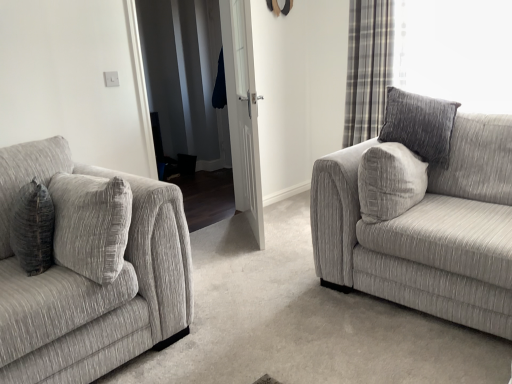
Question: From a real-world perspective, is textured gray couch at right, marked as the 2th studio couch in a left-to-right arrangement, below textured gray couch at left, acting as the 2th studio couch starting from the right?

Choices:
 (A) yes
 (B) no

Answer: (A)

Question: Is textured gray couch at right, which is counted as the first studio couch, starting from the right, at the right side of textured gray couch at left, acting as the 2th studio couch starting from the right?

Choices:
 (A) yes
 (B) no

Answer: (A)

Question: Does textured gray couch at right, marked as the 2th studio couch in a left-to-right arrangement, come behind textured gray couch at left, acting as the 2th studio couch starting from the right?

Choices:
 (A) yes
 (B) no

Answer: (A)

Question: Considering the relative positions of textured gray couch at right, which is counted as the first studio couch, starting from the right, and textured gray couch at left, acting as the 2th studio couch starting from the right, in the image provided, is textured gray couch at right, which is counted as the first studio couch, starting from the right, to the left of textured gray couch at left, acting as the 2th studio couch starting from the right, from the viewer's perspective?

Choices:
 (A) no
 (B) yes

Answer: (A)

Question: Does textured gray couch at right, which is counted as the first studio couch, starting from the right, have a lesser height compared to textured gray couch at left, which is counted as the first studio couch, starting from the left?

Choices:
 (A) no
 (B) yes

Answer: (B)

Question: From a real-world perspective, is textured gray couch at right, marked as the 2th studio couch in a left-to-right arrangement, positioned above or below white glossy door at center?

Choices:
 (A) below
 (B) above

Answer: (A)

Question: Relative to white glossy door at center, is textured gray couch at right, which is counted as the first studio couch, starting from the right, in front or behind?

Choices:
 (A) behind
 (B) front

Answer: (B)

Question: In terms of height, does textured gray couch at right, marked as the 2th studio couch in a left-to-right arrangement, look taller or shorter compared to white glossy door at center?

Choices:
 (A) short
 (B) tall

Answer: (A)

Question: Is textured gray couch at right, marked as the 2th studio couch in a left-to-right arrangement, situated inside white glossy door at center or outside?

Choices:
 (A) inside
 (B) outside

Answer: (B)

Question: Considering the positions of point (68, 198) and point (249, 96), is point (68, 198) closer or farther from the camera than point (249, 96)?

Choices:
 (A) closer
 (B) farther

Answer: (A)

Question: Relative to white glossy door at center, is textured gray couch at left, which is counted as the first studio couch, starting from the left, in front or behind?

Choices:
 (A) front
 (B) behind

Answer: (A)

Question: In terms of height, does textured gray couch at left, which is counted as the first studio couch, starting from the left, look taller or shorter compared to white glossy door at center?

Choices:
 (A) short
 (B) tall

Answer: (A)

Question: Considering the positions of textured gray couch at left, acting as the 2th studio couch starting from the right, and white glossy door at center in the image, is textured gray couch at left, acting as the 2th studio couch starting from the right, wider or thinner than white glossy door at center?

Choices:
 (A) thin
 (B) wide

Answer: (B)

Question: Considering their positions, is white glossy door at center located in front of or behind plaid fabric curtain at upper right?

Choices:
 (A) front
 (B) behind

Answer: (A)

Question: Looking at their shapes, would you say white glossy door at center is wider or thinner than plaid fabric curtain at upper right?

Choices:
 (A) thin
 (B) wide

Answer: (A)